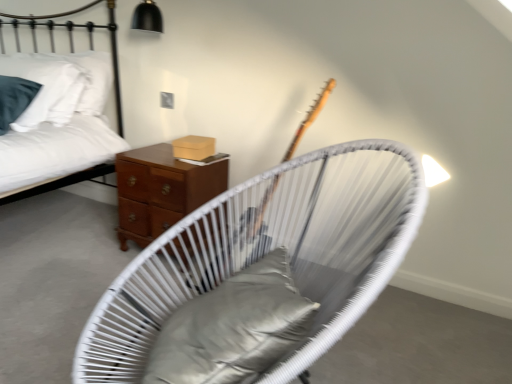
Question: Is point (155, 147) positioned closer to the camera than point (247, 311)?

Choices:
 (A) closer
 (B) farther

Answer: (B)

Question: Is mahogany wood nightstand at center inside the boundaries of satin gray pillow at center, or outside?

Choices:
 (A) inside
 (B) outside

Answer: (B)

Question: Estimate the real-world distances between objects in this image. Which object is farther from the mahogany wood nightstand at center?

Choices:
 (A) satin gray pillow at center
 (B) white cotton bed at upper left
 (C) white woven chair at center

Answer: (A)

Question: Based on their relative distances, which object is farther from the white cotton bed at upper left?

Choices:
 (A) mahogany wood nightstand at center
 (B) satin gray pillow at center
 (C) white woven chair at center

Answer: (B)